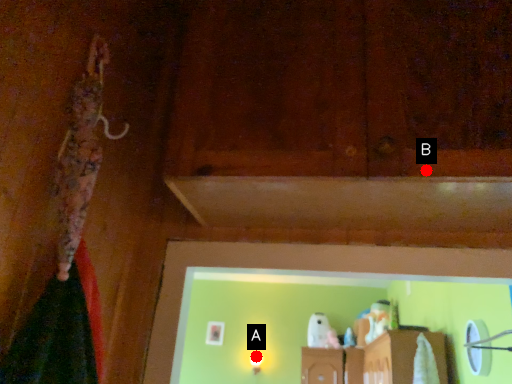
Question: Two points are circled on the image, labeled by A and B beside each circle. Among these points, which one is farthest from the camera?

Choices:
 (A) A is further
 (B) B is further

Answer: (A)